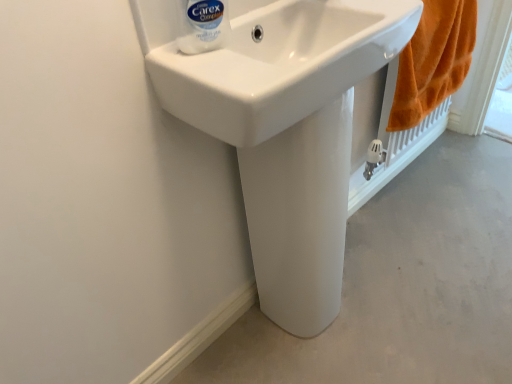
The image size is (512, 384). In order to click on white smooth pedestal at center in this screenshot , I will do `click(403, 286)`.

Find the location of a particular element. The height and width of the screenshot is (384, 512). white glossy pedestal at center is located at coordinates (300, 216).

Find the location of a particular element. The image size is (512, 384). orange fluffy towel at right is located at coordinates (433, 61).

Identify the location of white smooth pedestal at center. The image size is (512, 384). (403, 286).

Can you confirm if white smooth pedestal at center is thinner than orange fluffy towel at right?

Incorrect, the width of white smooth pedestal at center is not less than that of orange fluffy towel at right.

Is white smooth pedestal at center taller or shorter than orange fluffy towel at right?

white smooth pedestal at center is shorter than orange fluffy towel at right.

How distant is white smooth pedestal at center from orange fluffy towel at right?

The distance of white smooth pedestal at center from orange fluffy towel at right is 20.00 inches.

From a real-world perspective, which object rests below the other?

white smooth pedestal at center, from a real-world perspective.

I want to click on concrete below the white glossy pedestal at center (from a real-world perspective), so click(x=403, y=286).

Which of these two, white glossy pedestal at center or white smooth pedestal at center, is bigger?

With larger size is white smooth pedestal at center.

Is white glossy pedestal at center taller or shorter than white smooth pedestal at center?

Considering their sizes, white glossy pedestal at center has more height than white smooth pedestal at center.

From a real-world perspective, is orange fluffy towel at right positioned under white glossy pedestal at center based on gravity?

No, from a real-world perspective, orange fluffy towel at right is not beneath white glossy pedestal at center.

Considering the relative sizes of orange fluffy towel at right and white glossy pedestal at center in the image provided, is orange fluffy towel at right smaller than white glossy pedestal at center?

No, orange fluffy towel at right is not smaller than white glossy pedestal at center.

How distant is orange fluffy towel at right from white glossy pedestal at center?

A distance of 21.34 inches exists between orange fluffy towel at right and white glossy pedestal at center.

Consider the image. Is the surface of orange fluffy towel at right in direct contact with white glossy pedestal at center?

There is a gap between orange fluffy towel at right and white glossy pedestal at center.

From the image's perspective, who appears lower, white plastic bottle at upper center or white glossy pedestal at center?

white glossy pedestal at center.

Is white plastic bottle at upper center facing towards white glossy pedestal at center?

No, white plastic bottle at upper center does not turn towards white glossy pedestal at center.

From a real-world perspective, is white plastic bottle at upper center positioned above or below white glossy pedestal at center?

In terms of real-world spatial position, white plastic bottle at upper center is above white glossy pedestal at center.

Does white plastic bottle at upper center touch white glossy pedestal at center?

white plastic bottle at upper center is not next to white glossy pedestal at center, and they're not touching.

Is white glossy sink at center further to camera compared to orange fluffy towel at right?

No, the depth of white glossy sink at center is less than that of orange fluffy towel at right.

Where is `sink above the orange fluffy towel at right (from a real-world perspective)`? sink above the orange fluffy towel at right (from a real-world perspective) is located at coordinates (273, 61).

Is white glossy sink at center inside or outside of orange fluffy towel at right?

white glossy sink at center is outside orange fluffy towel at right.

From a real-world perspective, is white glossy sink at center located higher than orange fluffy towel at right?

Yes, from a real-world perspective, white glossy sink at center is over orange fluffy towel at right

Considering the positions of objects white glossy sink at center and white smooth pedestal at center in the image provided, who is more to the left, white glossy sink at center or white smooth pedestal at center?

white glossy sink at center is more to the left.

Considering the positions of points (146, 2) and (388, 213), is point (146, 2) closer to camera compared to point (388, 213)?

Yes, it is.

Can you confirm if white glossy sink at center is bigger than white smooth pedestal at center?

Incorrect, white glossy sink at center is not larger than white smooth pedestal at center.

Is white glossy sink at center not near white plastic bottle at upper center?

They are positioned close to each other.

Is white glossy sink at center aimed at white plastic bottle at upper center?

No, white glossy sink at center is not turned towards white plastic bottle at upper center.

In the image, there is a orange fluffy towel at right. Where is `concrete below it (from the image's perspective)`? Image resolution: width=512 pixels, height=384 pixels. concrete below it (from the image's perspective) is located at coordinates (403, 286).

In order to click on bidet above the white smooth pedestal at center (from the image's perspective) in this screenshot , I will do (300, 216).

Looking at this image, when comparing their distances from white glossy pedestal at center, does white glossy sink at center or white plastic bottle at upper center seem further?

white plastic bottle at upper center is further to white glossy pedestal at center.

Estimate the real-world distances between objects in this image. Which object is further from white glossy pedestal at center, orange fluffy towel at right or white smooth pedestal at center?

orange fluffy towel at right.

When comparing their distances from white smooth pedestal at center, does orange fluffy towel at right or white glossy pedestal at center seem closer?

white glossy pedestal at center lies closer to white smooth pedestal at center than the other object.

From the image, which object appears to be nearer to white plastic bottle at upper center, orange fluffy towel at right or white glossy pedestal at center?

white glossy pedestal at center is closer to white plastic bottle at upper center.

From the picture: When comparing their distances from orange fluffy towel at right, does white smooth pedestal at center or white plastic bottle at upper center seem closer?

white smooth pedestal at center lies closer to orange fluffy towel at right than the other object.

Estimate the real-world distances between objects in this image. Which object is further from white glossy sink at center, white smooth pedestal at center or orange fluffy towel at right?

The object further to white glossy sink at center is white smooth pedestal at center.

Estimate the real-world distances between objects in this image. Which object is closer to white glossy pedestal at center, orange fluffy towel at right or white glossy sink at center?

white glossy sink at center is closer to white glossy pedestal at center.

From the image, which object appears to be nearer to orange fluffy towel at right, white smooth pedestal at center or white glossy sink at center?

Among the two, white smooth pedestal at center is located nearer to orange fluffy towel at right.

At what (x,y) coordinates should I click in order to perform the action: click on sink between orange fluffy towel at right and white smooth pedestal at center in the up-down direction. Please return your answer as a coordinate pair (x, y). The width and height of the screenshot is (512, 384). Looking at the image, I should click on (273, 61).

Find the location of a particular element. bidet situated between white glossy sink at center and white smooth pedestal at center from left to right is located at coordinates (300, 216).

The image size is (512, 384). I want to click on sink between white plastic bottle at upper center and white glossy pedestal at center from top to bottom, so click(273, 61).

This screenshot has height=384, width=512. In order to click on bath towel situated between white plastic bottle at upper center and white smooth pedestal at center from left to right in this screenshot , I will do `click(433, 61)`.